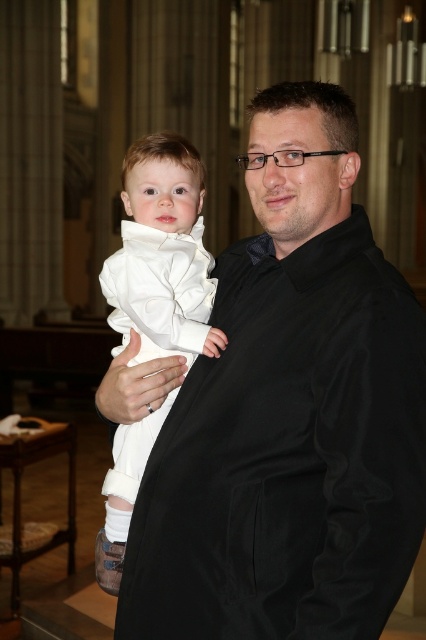
Question: Which point is closer to the camera taking this photo?

Choices:
 (A) (135, 545)
 (B) (195, 179)

Answer: (A)

Question: Among these points, which one is nearest to the camera?

Choices:
 (A) (127, 392)
 (B) (147, 259)

Answer: (A)

Question: Is black satin coat at center positioned behind white satin baby at center?

Choices:
 (A) no
 (B) yes

Answer: (A)

Question: Is black satin coat at center further to camera compared to white satin baby at center?

Choices:
 (A) no
 (B) yes

Answer: (A)

Question: Observing the image, what is the correct spatial positioning of black satin coat at center in reference to white satin baby at center?

Choices:
 (A) right
 (B) left

Answer: (A)